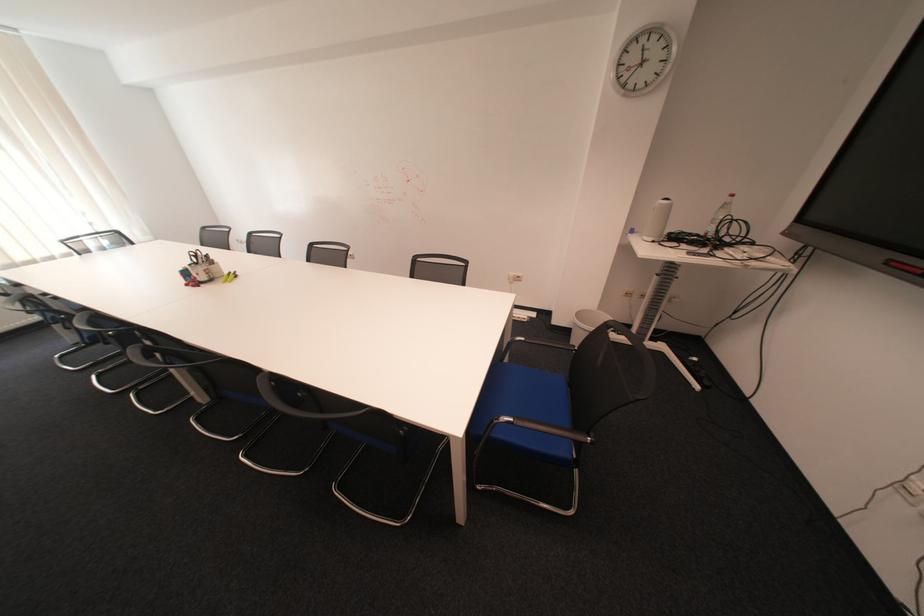
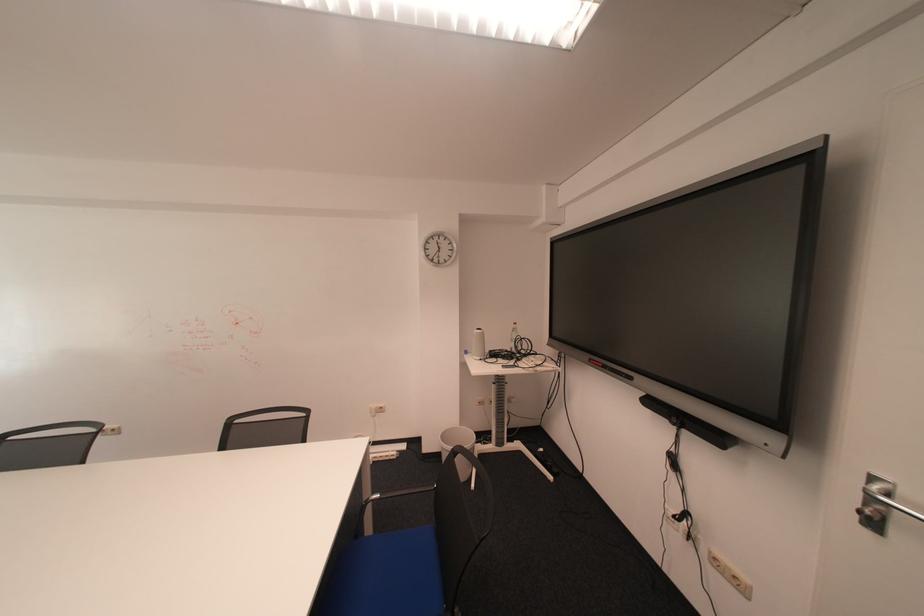
The point at (640, 235) is marked in the first image. Where is the corresponding point in the second image?

(477, 355)